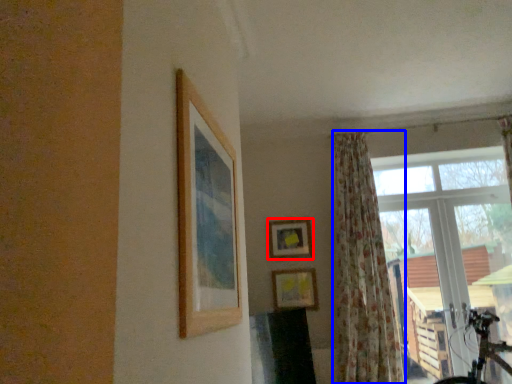
Question: Which point is further to the camera, picture frame (highlighted by a red box) or curtain (highlighted by a blue box)?

Choices:
 (A) picture frame
 (B) curtain

Answer: (A)